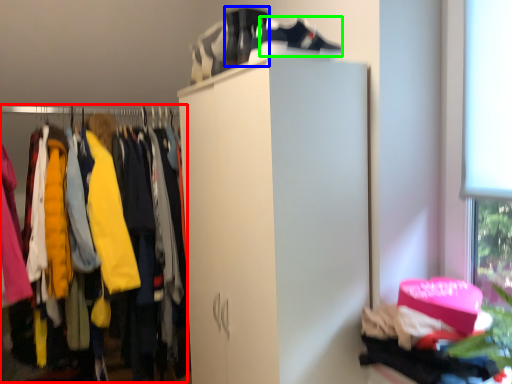
Question: Considering the real-world distances, which object is closest to closet (highlighted by a red box)? running shoe (highlighted by a blue box) or shoe (highlighted by a green box).

Choices:
 (A) running shoe
 (B) shoe

Answer: (A)